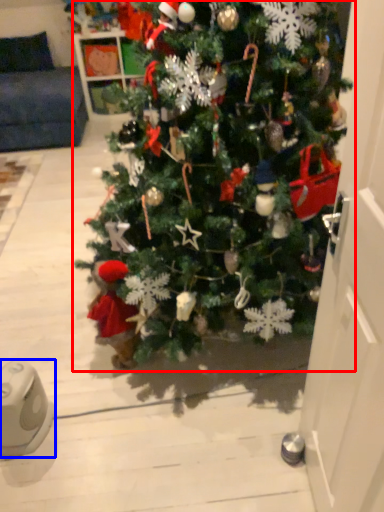
Question: Which of the following is the closest to the observer, christmas tree (highlighted by a red box) or ipod (highlighted by a blue box)?

Choices:
 (A) christmas tree
 (B) ipod

Answer: (A)